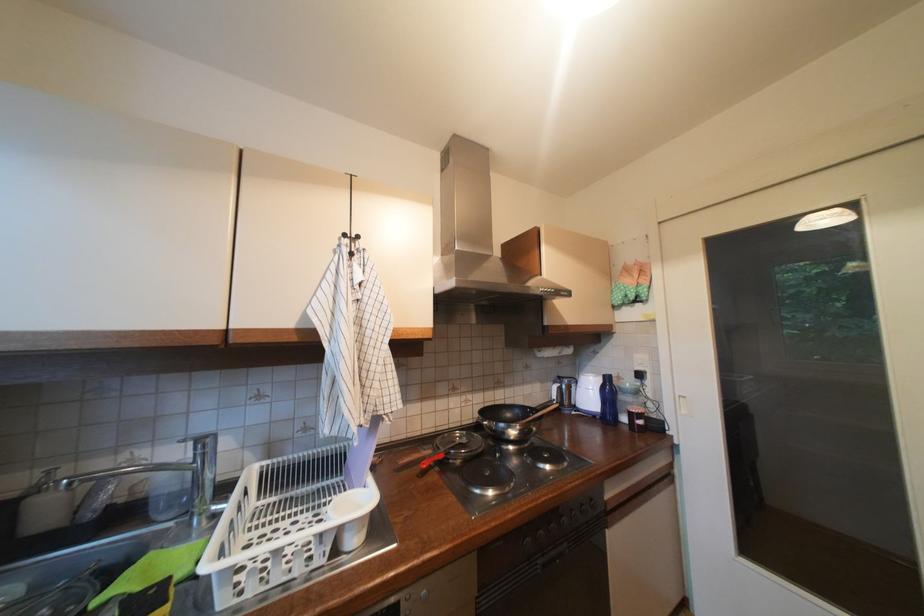
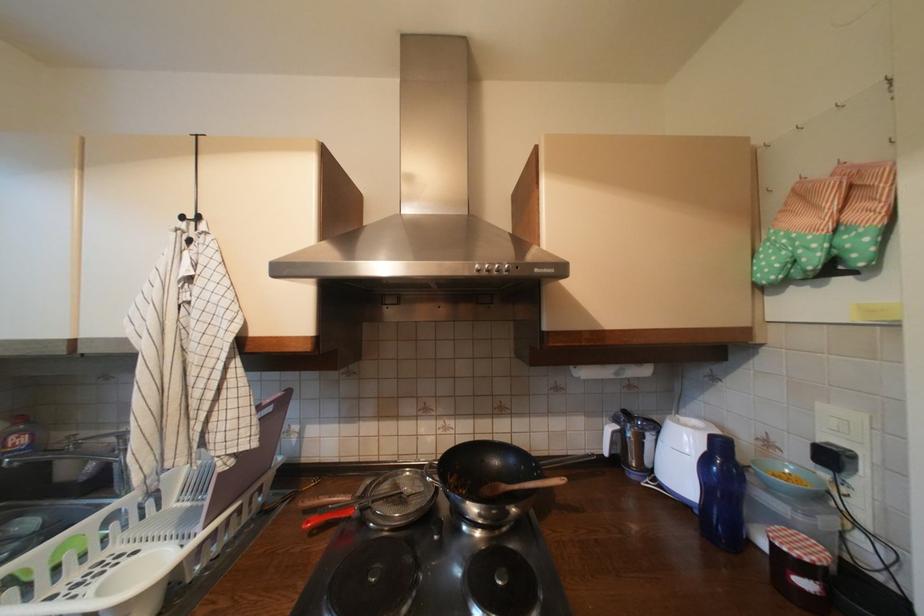
Locate, in the second image, the point that corresponds to pixel 358 237 in the first image.

(197, 219)